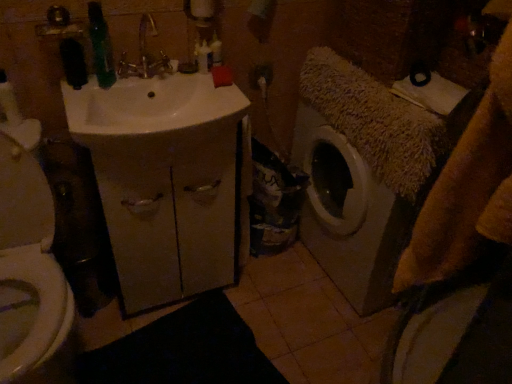
Question: Would you say translucent plastic bottle at upper center, which is the 1th toiletry in right-to-left order, contains white matte cabinet at center?

Choices:
 (A) no
 (B) yes

Answer: (A)

Question: Is translucent plastic bottle at upper center, which is the 1th toiletry in right-to-left order, positioned in front of white matte cabinet at center?

Choices:
 (A) no
 (B) yes

Answer: (A)

Question: From a real-world perspective, is translucent plastic bottle at upper center, positioned as the 2th toiletry in left-to-right order, beneath white matte cabinet at center?

Choices:
 (A) no
 (B) yes

Answer: (A)

Question: Considering the relative sizes of translucent plastic bottle at upper center, which is the 1th toiletry in right-to-left order, and white matte cabinet at center in the image provided, is translucent plastic bottle at upper center, which is the 1th toiletry in right-to-left order, smaller than white matte cabinet at center?

Choices:
 (A) no
 (B) yes

Answer: (B)

Question: Does translucent plastic bottle at upper center, positioned as the 2th toiletry in left-to-right order, have a lesser height compared to white matte cabinet at center?

Choices:
 (A) no
 (B) yes

Answer: (B)

Question: Is translucent plastic bottle at upper center, positioned as the 2th toiletry in left-to-right order, spatially inside gold metallic faucet at upper center, or outside of it?

Choices:
 (A) outside
 (B) inside

Answer: (A)

Question: From a real-world perspective, is translucent plastic bottle at upper center, positioned as the 2th toiletry in left-to-right order, positioned above or below gold metallic faucet at upper center?

Choices:
 (A) below
 (B) above

Answer: (A)

Question: In terms of size, does translucent plastic bottle at upper center, which is the 1th toiletry in right-to-left order, appear bigger or smaller than gold metallic faucet at upper center?

Choices:
 (A) big
 (B) small

Answer: (B)

Question: Is translucent plastic bottle at upper center, which is the 1th toiletry in right-to-left order, to the left or to the right of gold metallic faucet at upper center in the image?

Choices:
 (A) left
 (B) right

Answer: (B)

Question: Is point (202, 69) positioned closer to the camera than point (135, 251)?

Choices:
 (A) farther
 (B) closer

Answer: (B)

Question: Looking at their shapes, would you say white plastic bottle at upper center, the 2th toiletry when ordered from right to left, is wider or thinner than white matte cabinet at center?

Choices:
 (A) wide
 (B) thin

Answer: (B)

Question: Considering the relative positions of white plastic bottle at upper center, which is counted as the first toiletry, starting from the left, and white matte cabinet at center in the image provided, is white plastic bottle at upper center, which is counted as the first toiletry, starting from the left, to the left or to the right of white matte cabinet at center?

Choices:
 (A) right
 (B) left

Answer: (A)

Question: Considering their positions, is white plastic bottle at upper center, the 2th toiletry when ordered from right to left, located in front of or behind white matte cabinet at center?

Choices:
 (A) front
 (B) behind

Answer: (B)

Question: Considering the positions of white plastic bottle at upper center, the 2th toiletry when ordered from right to left, and white glossy toilet at left in the image, is white plastic bottle at upper center, the 2th toiletry when ordered from right to left, wider or thinner than white glossy toilet at left?

Choices:
 (A) thin
 (B) wide

Answer: (A)

Question: Considering the positions of white plastic bottle at upper center, the 2th toiletry when ordered from right to left, and white glossy toilet at left in the image, is white plastic bottle at upper center, the 2th toiletry when ordered from right to left, taller or shorter than white glossy toilet at left?

Choices:
 (A) tall
 (B) short

Answer: (B)